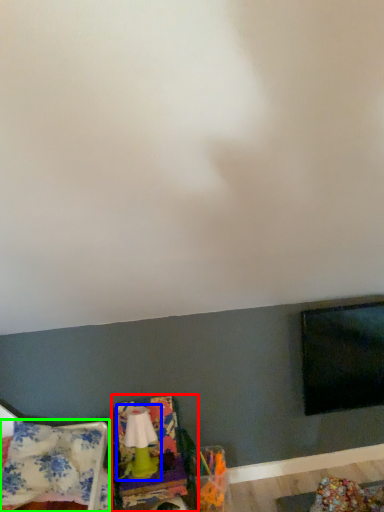
Question: Which object is the farthest from swivel chair (highlighted by a red box)? Choose among these: lamp (highlighted by a blue box) or blanket (highlighted by a green box).

Choices:
 (A) lamp
 (B) blanket

Answer: (B)